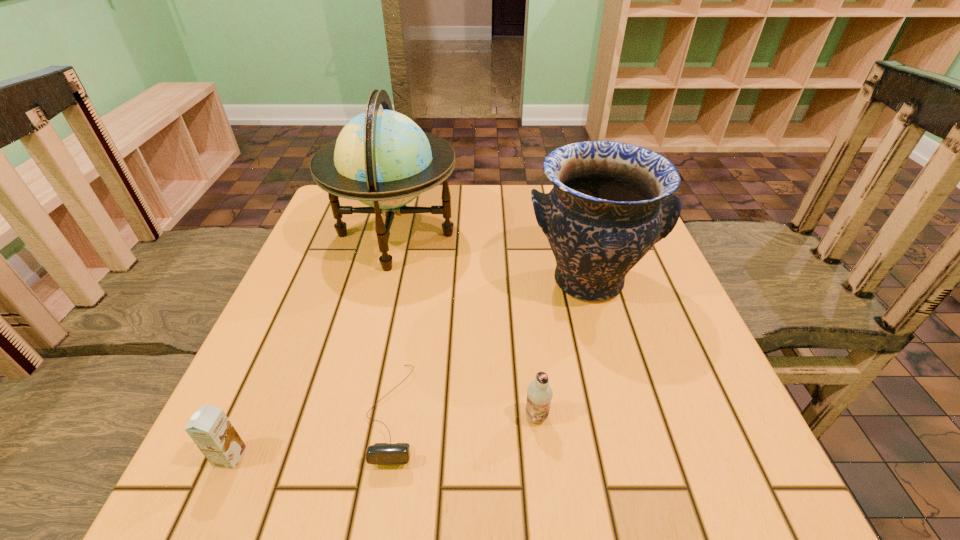
Locate an element on the screen. the tallest object is located at coordinates (382, 158).

Identify the location of the fourth shortest object. (611, 202).

At what (x,y) coordinates should I click in order to perform the action: click on the left chocolate milk. Please return your answer as a coordinate pair (x, y). The image size is (960, 540). Looking at the image, I should click on (209, 427).

The width and height of the screenshot is (960, 540). Identify the location of the right chocolate milk. (539, 393).

You are a GUI agent. You are given a task and a screenshot of the screen. Output one action in this format:
    pyautogui.click(x=<x>, y=<y>)
    Task: Click on the shortest object
    
    Given the screenshot: What is the action you would take?
    pyautogui.click(x=380, y=453)

You are a GUI agent. You are given a task and a screenshot of the screen. Output one action in this format:
    pyautogui.click(x=<x>, y=<y>)
    Task: Click on the vacant region located on the surface of the tallest object
    
    Given the screenshot: What is the action you would take?
    pyautogui.click(x=572, y=235)

The width and height of the screenshot is (960, 540). Find the location of `free location located 0.230m on the front handle of the fourth shortest object`. free location located 0.230m on the front handle of the fourth shortest object is located at coordinates coord(628,428).

The image size is (960, 540). In order to click on vacant region located 0.260m on the back of the nearer chocolate milk in this screenshot , I will do `click(291, 321)`.

Find the location of a particular element. free space located on the back of the farther chocolate milk is located at coordinates (528, 337).

You are a GUI agent. You are given a task and a screenshot of the screen. Output one action in this format:
    pyautogui.click(x=<x>, y=<y>)
    Task: Click on the object at the far edge
    
    Given the screenshot: What is the action you would take?
    pyautogui.click(x=382, y=158)